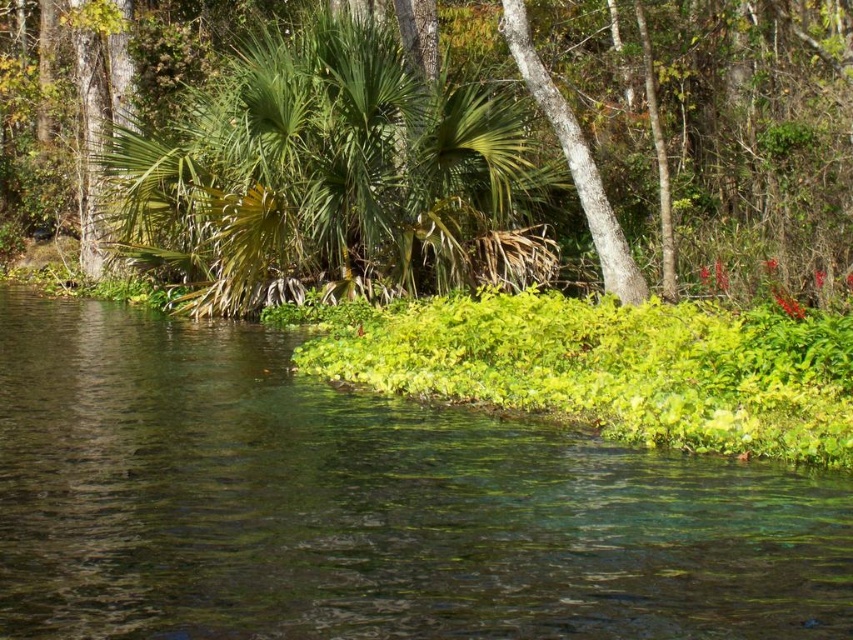
Question: Does green leafy vegetation at lower center come behind green leafy tree at center?

Choices:
 (A) yes
 (B) no

Answer: (B)

Question: From the image, what is the correct spatial relationship of green leafy vegetation at lower center in relation to green leafy tree at center?

Choices:
 (A) left
 (B) right

Answer: (B)

Question: Is green leafy vegetation at lower center wider than green leafy tree at center?

Choices:
 (A) no
 (B) yes

Answer: (A)

Question: Which object appears farthest from the camera in this image?

Choices:
 (A) green leafy vegetation at lower center
 (B) green leafy tree at center

Answer: (B)